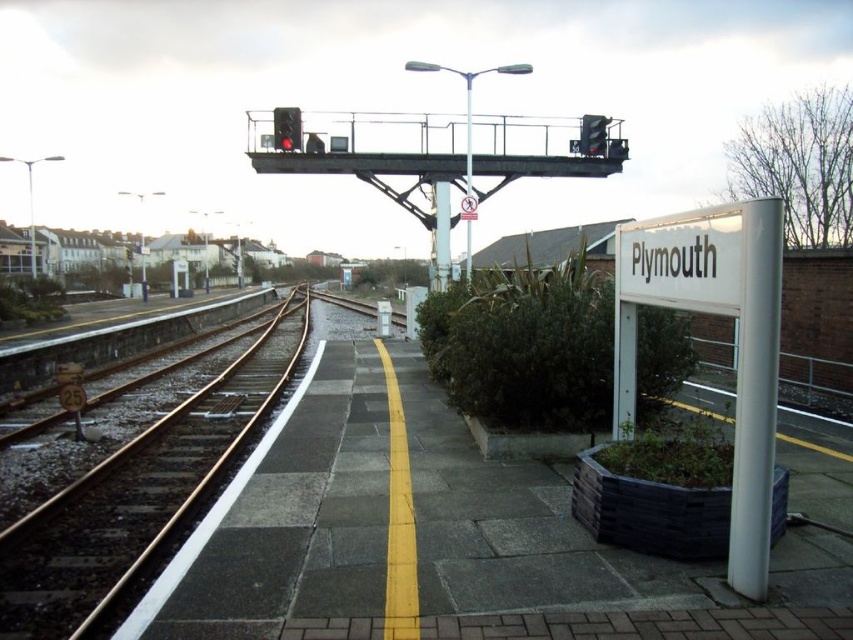
Does point (473, 189) lie in front of point (276, 145)?

That is False.

Does metallic pole at upper center have a lesser height compared to red glass traffic light at upper center?

Incorrect, metallic pole at upper center's height does not fall short of red glass traffic light at upper center's.

Which is in front, point (466, 163) or point (280, 138)?

Point (466, 163) is more forward.

Locate an element on the screen. This screenshot has height=640, width=853. metallic pole at upper center is located at coordinates (468, 131).

Is red glass traffic light at upper center behind metallic traffic light at upper center?

No, it is not.

Image resolution: width=853 pixels, height=640 pixels. What do you see at coordinates (287, 129) in the screenshot?
I see `red glass traffic light at upper center` at bounding box center [287, 129].

You are a GUI agent. You are given a task and a screenshot of the screen. Output one action in this format:
    pyautogui.click(x=<x>, y=<y>)
    Task: Click on the red glass traffic light at upper center
    
    Given the screenshot: What is the action you would take?
    point(287,129)

Which is in front, point (447, 276) or point (599, 152)?

Point (447, 276) is more forward.

Is point (447, 221) positioned before point (593, 141)?

No, it is not.

I want to click on metallic pole at center, so click(x=440, y=236).